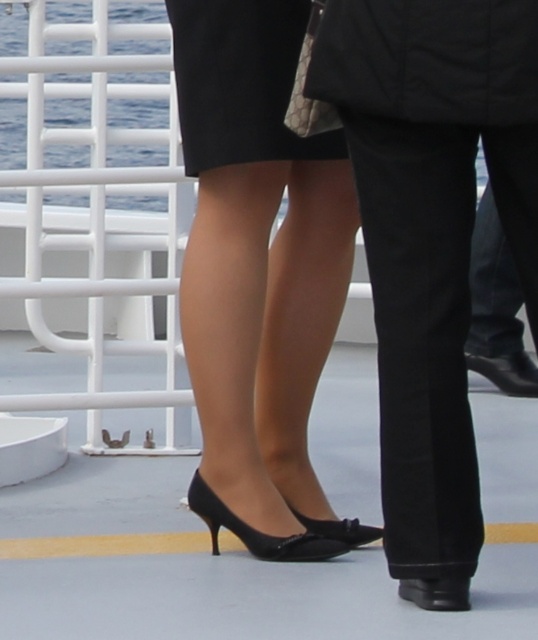
Question: Does black patent leather high heels at center have a lesser width compared to black leather shoe at lower center?

Choices:
 (A) no
 (B) yes

Answer: (A)

Question: Which of these objects is positioned closest to the black patent leather heels at center?

Choices:
 (A) black patent leather high heels at center
 (B) black leather shoe at lower center

Answer: (A)

Question: Based on their relative distances, which object is nearer to the black patent leather heels at center?

Choices:
 (A) black satin dress at center
 (B) black leather shoe at lower center

Answer: (B)

Question: Does black satin dress at center lie in front of black leather shoe at lower center?

Choices:
 (A) no
 (B) yes

Answer: (A)

Question: From the image, what is the correct spatial relationship of black patent leather heels at center in relation to black leather shoe at lower center?

Choices:
 (A) left
 (B) right

Answer: (A)

Question: Which point appears farthest from the camera in this image?

Choices:
 (A) (217, 502)
 (B) (204, 164)
 (C) (444, 579)

Answer: (A)